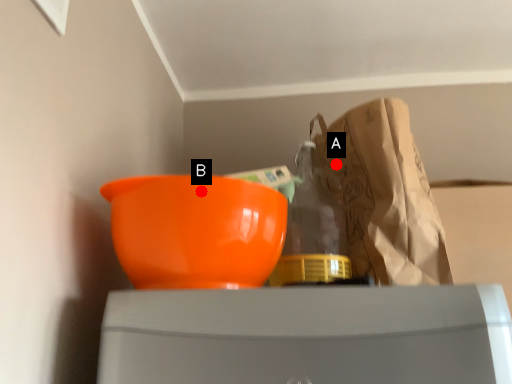
Question: Two points are circled on the image, labeled by A and B beside each circle. Which point appears farthest from the camera in this image?

Choices:
 (A) A is further
 (B) B is further

Answer: (A)